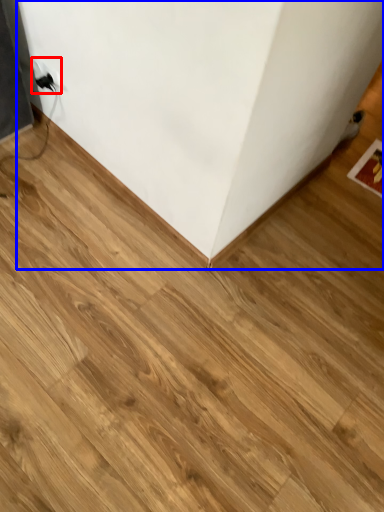
Question: Which object appears closest to the camera in this image, electric outlet (highlighted by a red box) or furniture (highlighted by a blue box)?

Choices:
 (A) electric outlet
 (B) furniture

Answer: (B)